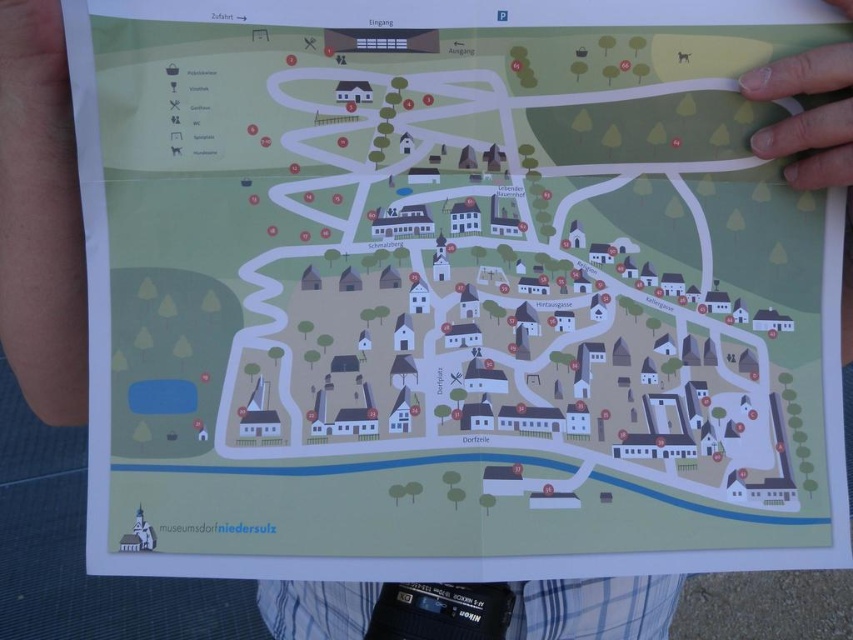
You are a museum visitor holding the map titled museumsdorf niedersulz. You see the skinsmoothhand at left and the white matte finger at upper right pointing to a landmark. Which object is wider?

The skinsmoothhand at left might be wider than the white matte finger at upper right according to the map description.